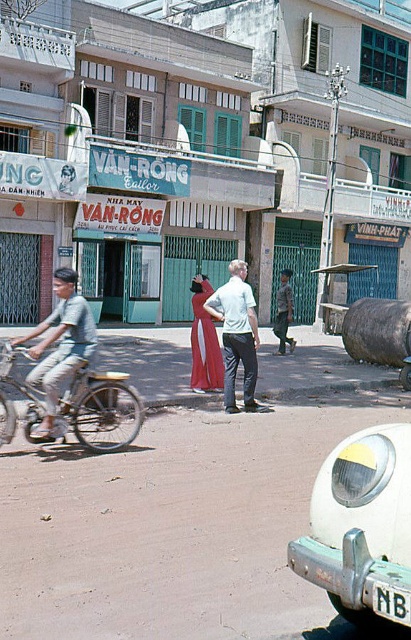
Is silver metallic bicycle at left above matte gray bicycle at left?

No, silver metallic bicycle at left is not above matte gray bicycle at left.

Does silver metallic bicycle at left have a greater height compared to matte gray bicycle at left?

In fact, silver metallic bicycle at left may be shorter than matte gray bicycle at left.

Does point (108, 419) come behind point (39, 353)?

Yes.

The image size is (411, 640). I want to click on silver metallic bicycle at left, so click(78, 403).

Consider the image. Can you confirm if matte red dress at center is taller than light brown fabric shirt at center?

In fact, matte red dress at center may be shorter than light brown fabric shirt at center.

Who is lower down, matte red dress at center or light brown fabric shirt at center?

matte red dress at center

At what (x,y) coordinates should I click in order to perform the action: click on matte red dress at center. Please return your answer as a coordinate pair (x, y). This screenshot has height=640, width=411. Looking at the image, I should click on (203, 340).

The width and height of the screenshot is (411, 640). What are the coordinates of `matte red dress at center` in the screenshot? It's located at (203, 340).

Is white matte scooter at lower right positioned behind light brown fabric shirt at center?

No, white matte scooter at lower right is in front of light brown fabric shirt at center.

From the picture: Is white matte scooter at lower right smaller than light brown fabric shirt at center?

Yes.

Describe the element at coordinates (362, 528) in the screenshot. I see `white matte scooter at lower right` at that location.

The image size is (411, 640). In order to click on white matte scooter at lower right in this screenshot , I will do `click(362, 528)`.